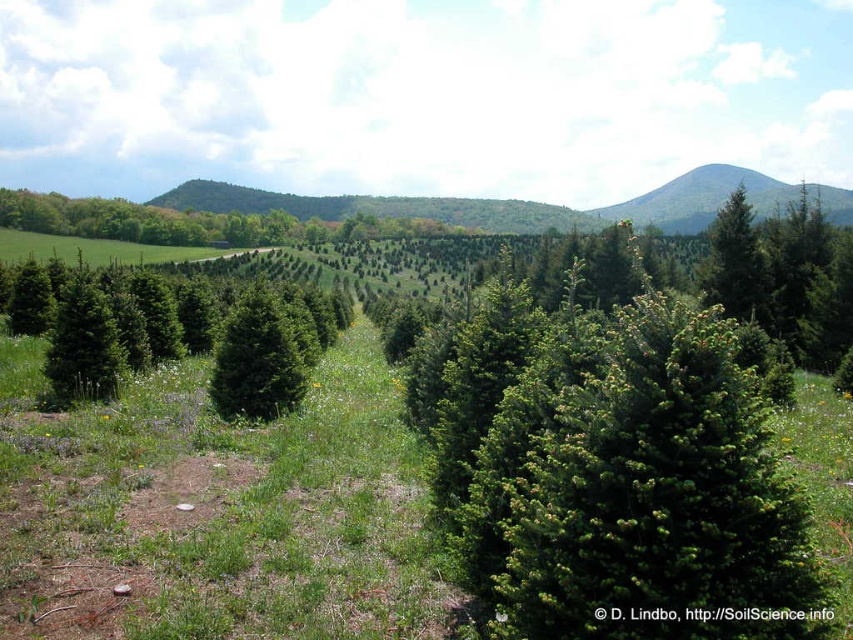
Can you confirm if green textured hillside at upper right is thinner than green matte evergreen tree at upper right?

Incorrect, green textured hillside at upper right's width is not less than green matte evergreen tree at upper right's.

Is green textured hillside at upper right below green matte evergreen tree at upper right?

No.

Where is `green textured hillside at upper right`? The image size is (853, 640). green textured hillside at upper right is located at coordinates (720, 198).

This screenshot has height=640, width=853. I want to click on green textured hillside at upper right, so click(x=720, y=198).

Does green matte evergreen tree at center come behind green textured hillside at upper right?

No, green matte evergreen tree at center is in front of green textured hillside at upper right.

Can you confirm if green matte evergreen tree at center is positioned to the right of green textured hillside at upper right?

No, green matte evergreen tree at center is not to the right of green textured hillside at upper right.

Is point (302, 330) positioned before point (833, 188)?

Yes, point (302, 330) is in front of point (833, 188).

What are the coordinates of `green matte evergreen tree at center` in the screenshot? It's located at (172, 332).

Is green matte evergreen tree at center taller than green matte evergreen tree at upper right?

No.

Can you confirm if green matte evergreen tree at center is shorter than green matte evergreen tree at upper right?

Yes, green matte evergreen tree at center is shorter than green matte evergreen tree at upper right.

What do you see at coordinates (172, 332) in the screenshot?
I see `green matte evergreen tree at center` at bounding box center [172, 332].

Image resolution: width=853 pixels, height=640 pixels. What are the coordinates of `green matte evergreen tree at center` in the screenshot? It's located at (172, 332).